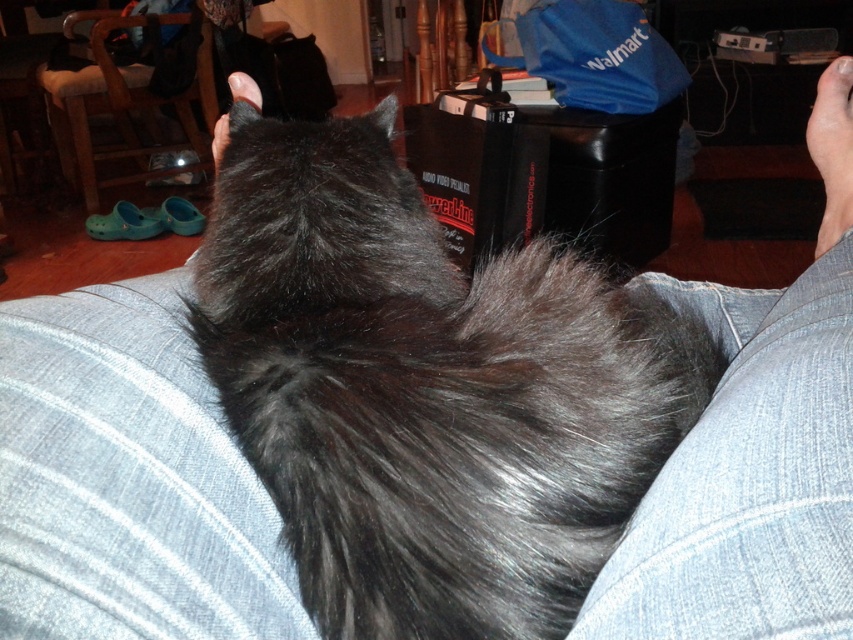
Question: Does fuzzy fur at center have a greater width compared to denim at lower right?

Choices:
 (A) yes
 (B) no

Answer: (B)

Question: Can you confirm if fluffy black cat at center is positioned below fuzzy fur at center?

Choices:
 (A) no
 (B) yes

Answer: (A)

Question: Which point appears closest to the camera in this image?

Choices:
 (A) (376, 515)
 (B) (795, 374)
 (C) (39, 577)

Answer: (C)

Question: Which of the following is the farthest from the observer?

Choices:
 (A) denim at lower right
 (B) fuzzy fur at center

Answer: (B)

Question: Does fuzzy fur at center appear over denim at lower right?

Choices:
 (A) no
 (B) yes

Answer: (A)

Question: Which object is positioned closest to the denim at lower right?

Choices:
 (A) fluffy black cat at center
 (B) fuzzy fur at center

Answer: (A)